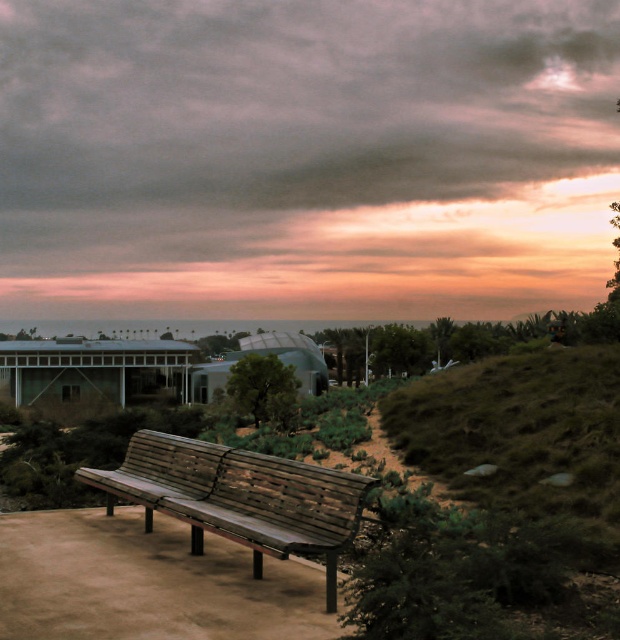
You are sitting on the wooden bench at center and looking straight ahead. Which direction should you turn your head to see the cloudy sky at upper center?

You should turn your head to the right to see the cloudy sky at upper center because it is located to the right of the wooden bench at center.

Based on the photo, you are standing at the wooden bench in the foreground of the scene. You want to estimate how far the cloudy sky at upper center is from your current position. What is the approximate distance?

The cloudy sky at upper center is approximately 199.12 feet away from the viewer.